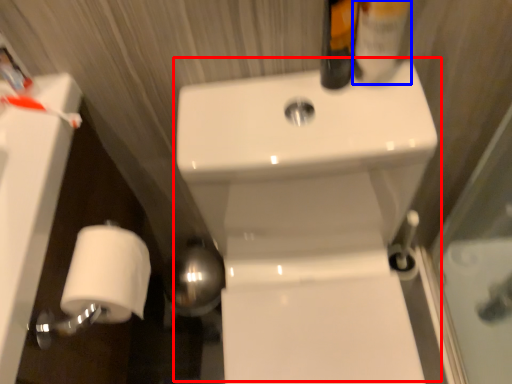
Question: Which object is further to the camera taking this photo, sink (highlighted by a red box) or mouthwash (highlighted by a blue box)?

Choices:
 (A) sink
 (B) mouthwash

Answer: (B)